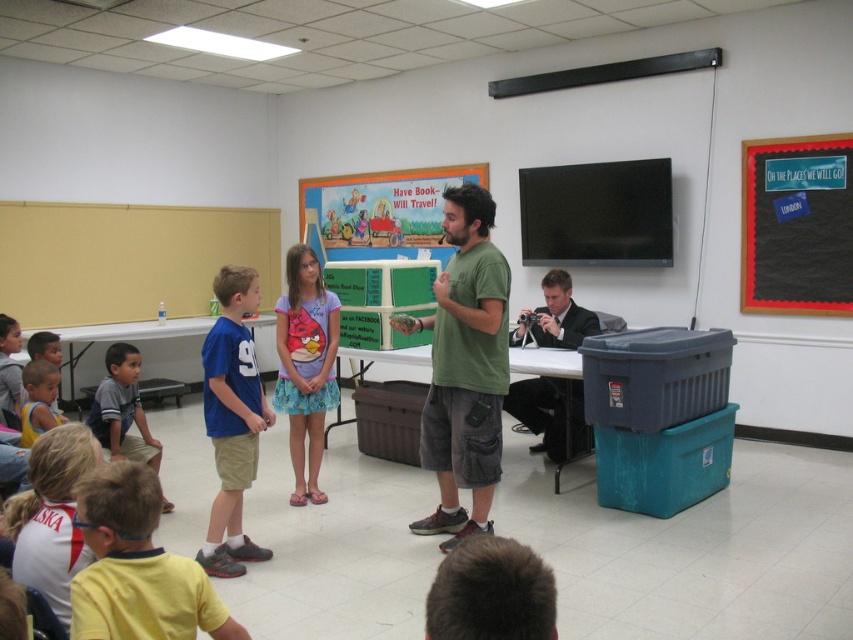
You are standing at the entrance of the classroom and see the green cotton shirt at center and the gray cotton shirt at lower left. If you want to reach both shirts to hand out materials, which one would you need to walk further to reach?

The gray cotton shirt at lower left is further away from you since the green cotton shirt at center is only 6.05 feet away from it, implying that the gray cotton shirt is positioned farther from the entrance compared to the green one.

You are standing at point (126, 346) and want to walk to point (851, 298). Is the destination point behind you?

Yes, the destination point (851, 298) is behind you because it is located behind point (126, 346) where you are standing.